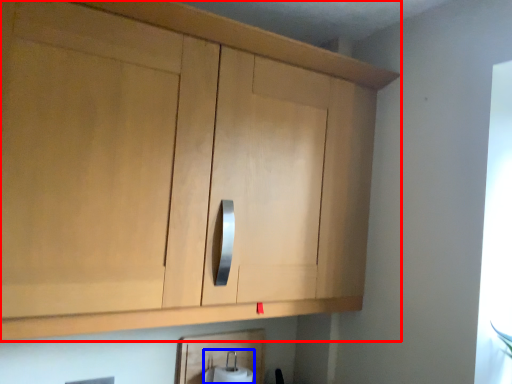
Question: Among these objects, which one is nearest to the camera, cabinetry (highlighted by a red box) or toilet paper (highlighted by a blue box)?

Choices:
 (A) cabinetry
 (B) toilet paper

Answer: (A)